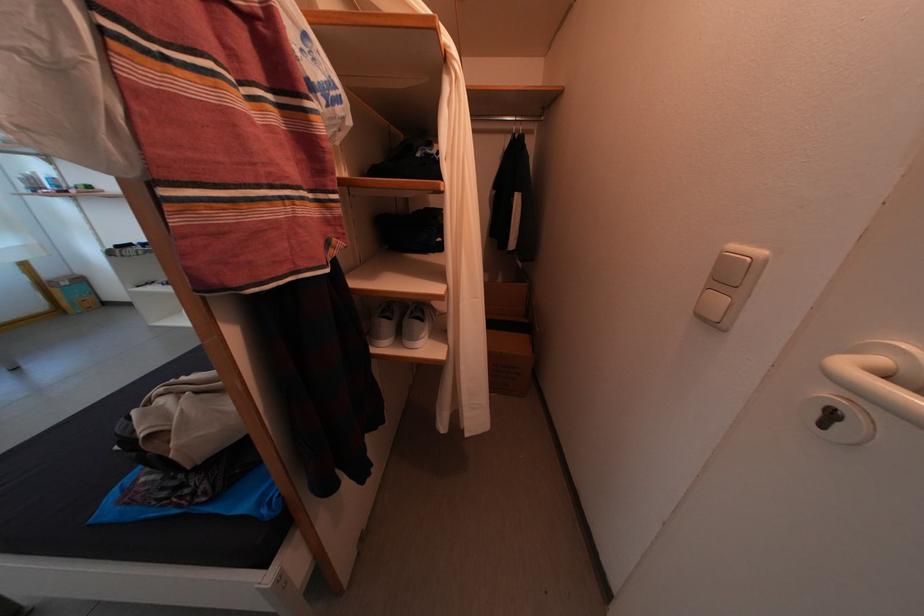
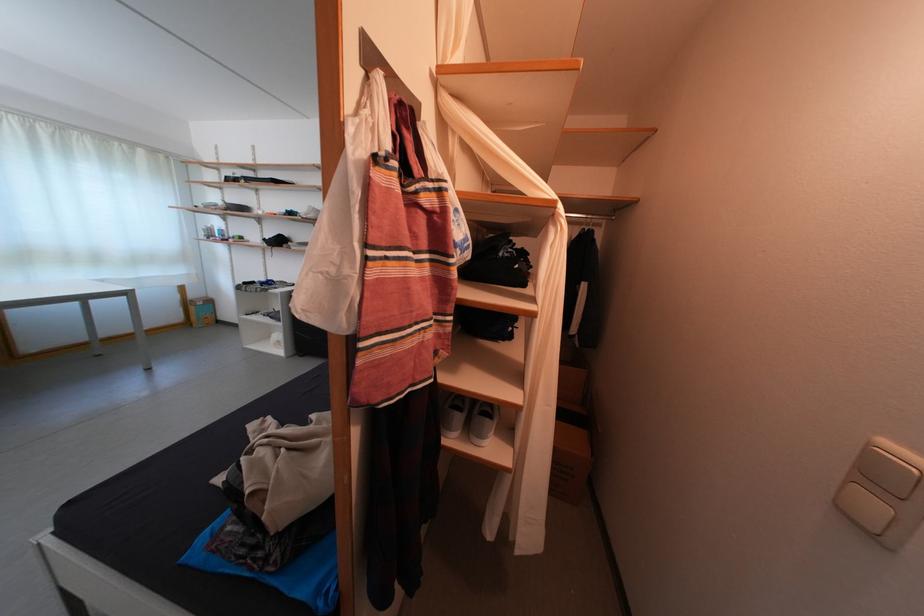
Which direction would the cameraman need to move to produce the second image?

The cameraman moved toward left, backward.